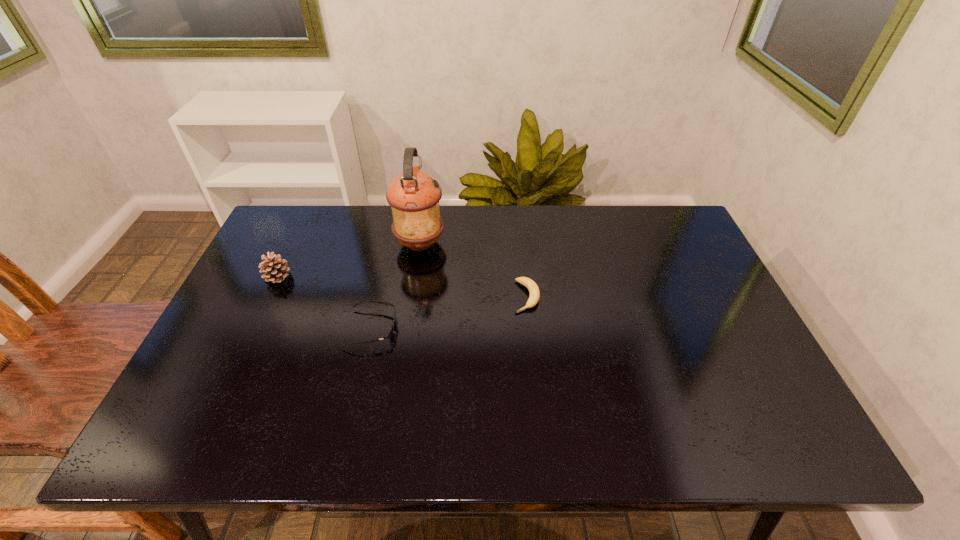
Find the location of `object that stands as the closest to the leftmost object`. object that stands as the closest to the leftmost object is located at coordinates (389, 335).

Choose which object is the nearest neighbor to the third tallest object. Please provide its 2D coordinates. Your answer should be formatted as a tuple, i.e. [(x, y)], where the tuple contains the x and y coordinates of a point satisfying the conditions above.

[(413, 195)]

What are the coordinates of `free point that satisfies the following two spatial constraints: 1. on the front side of the oil lamp; 2. on the front-facing side of the sunglasses` in the screenshot? It's located at coord(407,328).

Locate an element on the screen. free space that satisfies the following two spatial constraints: 1. on the back side of the second tallest object; 2. on the right side of the farthest object is located at coordinates (294, 243).

Where is `free spot that satisfies the following two spatial constraints: 1. at the stem of the rightmost object; 2. on the front-facing side of the third tallest object`? free spot that satisfies the following two spatial constraints: 1. at the stem of the rightmost object; 2. on the front-facing side of the third tallest object is located at coordinates (530, 328).